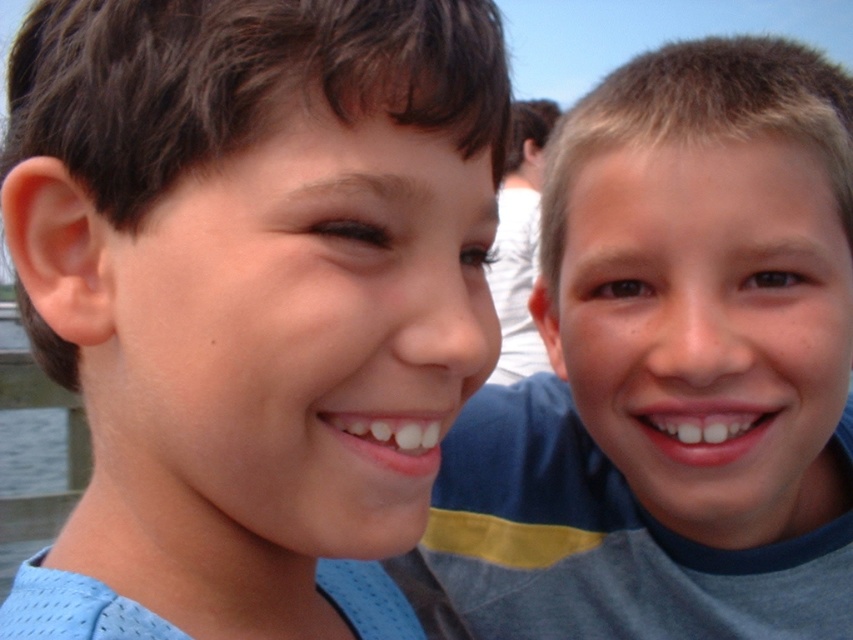
Who is shorter, blue mesh shirt at left or smooth blue shirt at right?

With less height is blue mesh shirt at left.

Who is more forward, (57, 364) or (683, 522)?

Point (57, 364) is in front.

Where is `blue mesh shirt at left`? The image size is (853, 640). blue mesh shirt at left is located at coordinates (250, 298).